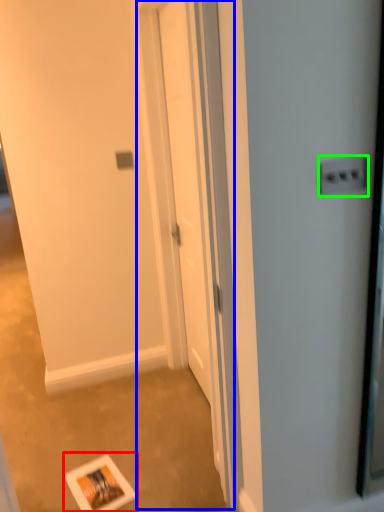
Question: Which is farther away from postcard (highlighted by a red box)? screen door (highlighted by a blue box) or electric outlet (highlighted by a green box)?

Choices:
 (A) screen door
 (B) electric outlet

Answer: (B)